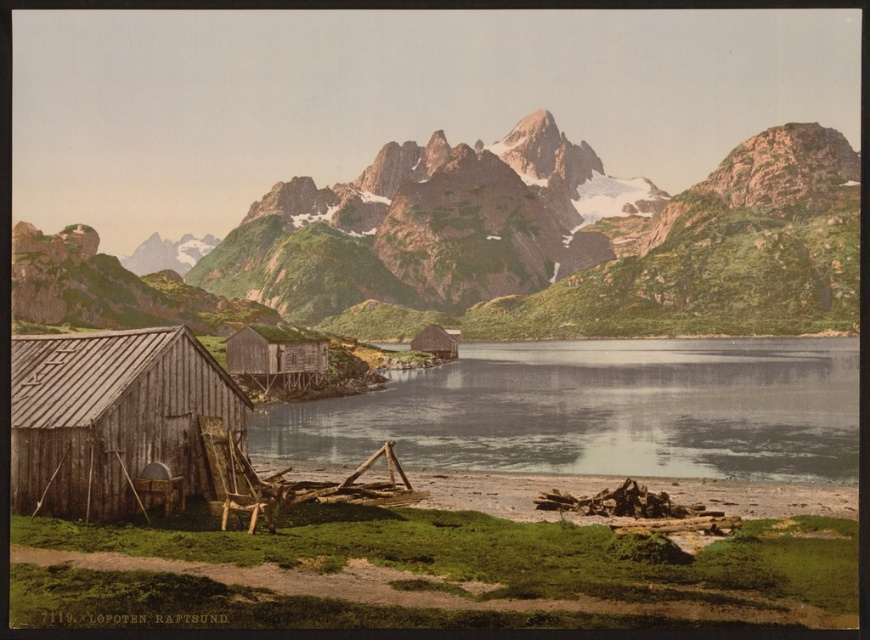
Based on the photo, you are a photographer planning to capture the reflection of the wooden shack at lower left in the smooth gray water at center. Based on the scene description, will the reflection be visible in the water?

The smooth gray water at center is below the wooden shack at lower left, so the reflection of the wooden shack at lower left would not be visible in the water since the shack is positioned above the water.